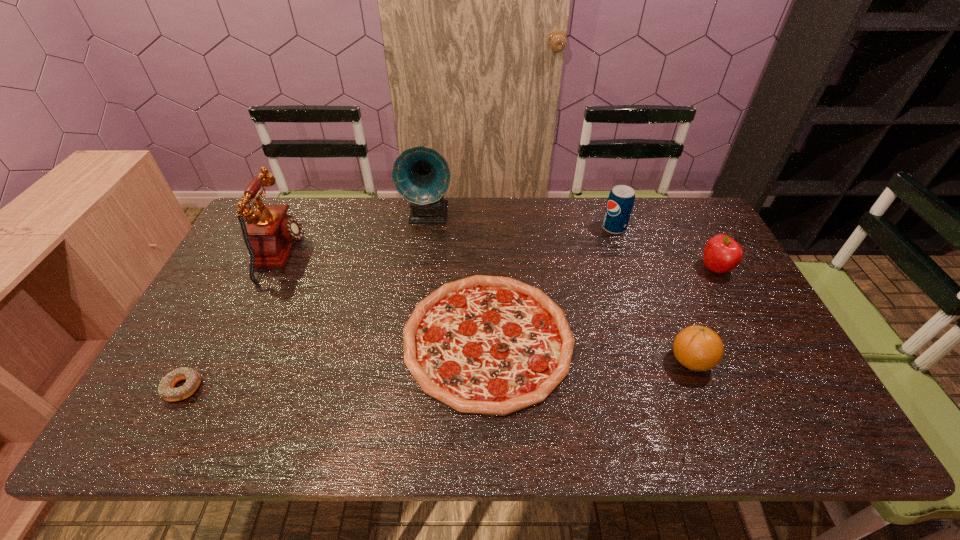
Point out which object is positioned as the nearest to the telephone. Please provide its 2D coordinates. Your answer should be formatted as a tuple, i.e. [(x, y)], where the tuple contains the x and y coordinates of a point satisfying the conditions above.

[(421, 175)]

Where is `blank space that satisfies the following two spatial constraints: 1. on the dial of the apple; 2. on the left side of the second tallest object`? blank space that satisfies the following two spatial constraints: 1. on the dial of the apple; 2. on the left side of the second tallest object is located at coordinates (276, 269).

This screenshot has width=960, height=540. Find the location of `blank space that satisfies the following two spatial constraints: 1. from the horn of the phonograph_record; 2. on the dial of the telephone`. blank space that satisfies the following two spatial constraints: 1. from the horn of the phonograph_record; 2. on the dial of the telephone is located at coordinates (423, 255).

Where is `vacant space that satisfies the following two spatial constraints: 1. on the front side of the fifth shortest object; 2. on the right side of the orange`? The image size is (960, 540). vacant space that satisfies the following two spatial constraints: 1. on the front side of the fifth shortest object; 2. on the right side of the orange is located at coordinates (660, 361).

The width and height of the screenshot is (960, 540). What are the coordinates of `vacant area in the image that satisfies the following two spatial constraints: 1. on the dial of the telephone; 2. on the right side of the orange` in the screenshot? It's located at [231, 361].

At what (x,y) coordinates should I click in order to perform the action: click on free location that satisfies the following two spatial constraints: 1. from the horn of the phonograph_record; 2. on the right side of the fifth shortest object. Please return your answer as a coordinate pair (x, y). This screenshot has width=960, height=540. Looking at the image, I should click on (426, 228).

Locate an element on the screen. free space in the image that satisfies the following two spatial constraints: 1. on the dial of the pizza; 2. on the left side of the telephone is located at coordinates [242, 340].